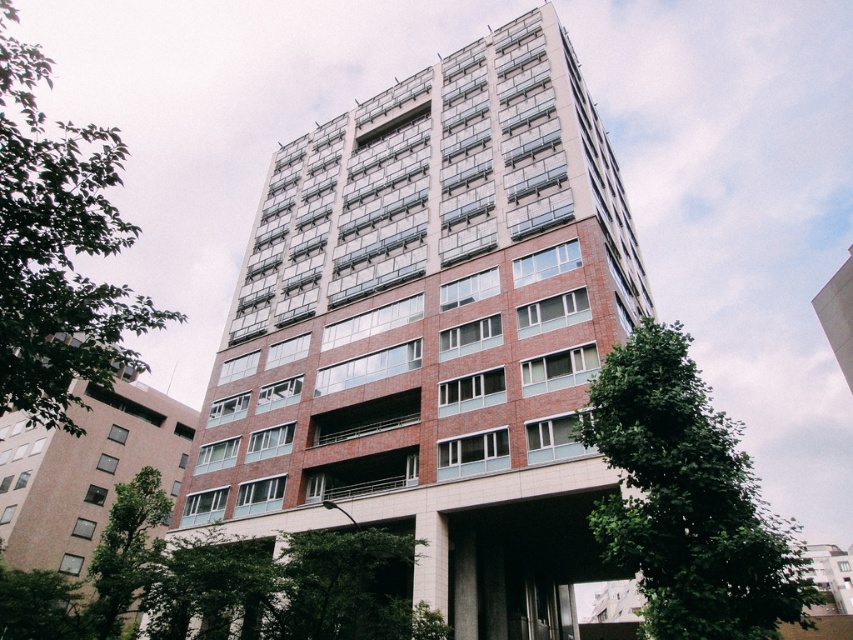
You are standing at the base of the building and want to take a photo of the green leafy tree at lower right. If your camera has a maximum zoom range of 10 meters, will you be able to capture the tree clearly without moving closer?

The distance between the green leafy tree at lower right and the viewer is 12.89 meters, which exceeds the camera maximum zoom range of 10 meters. Therefore, you will not be able to capture the tree clearly without moving closer.

You are standing at the base of the building and looking up. There is a point marked at coordinates [686,499]. What is located at this point?

The point at coordinates [686,499] indicates a green leafy tree at lower right.